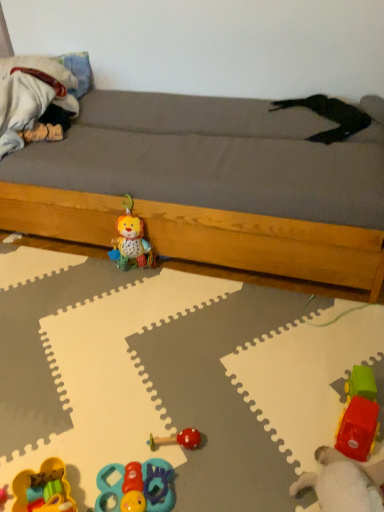
Where is `empty space that is in between rubberized plastic truck at lower right, the 6th toy positioned from the left, and smooth plastic rattle at center, acting as the fourth toy starting from the left`? This screenshot has height=512, width=384. empty space that is in between rubberized plastic truck at lower right, the 6th toy positioned from the left, and smooth plastic rattle at center, acting as the fourth toy starting from the left is located at coordinates (263, 421).